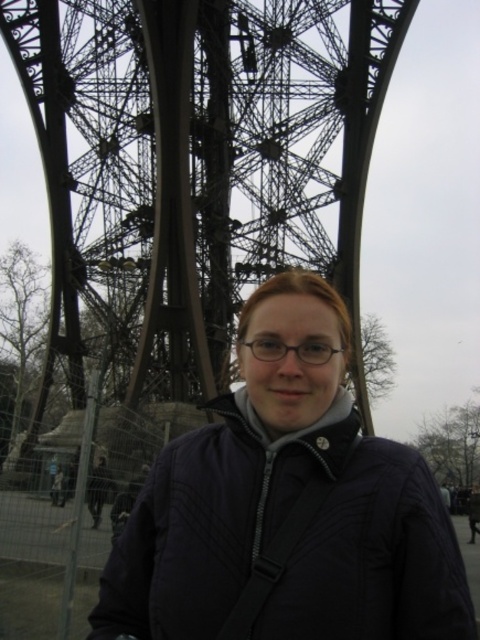
Question: Which object appears farthest from the camera in this image?

Choices:
 (A) matte black jacket at center
 (B) metallic structure at center

Answer: (B)

Question: Which of the following is the farthest from the observer?

Choices:
 (A) metallic structure at center
 (B) matte black jacket at center

Answer: (A)

Question: Considering the relative positions of metallic structure at center and matte black jacket at center in the image provided, where is metallic structure at center located with respect to matte black jacket at center?

Choices:
 (A) below
 (B) above

Answer: (B)

Question: Can you confirm if metallic structure at center is thinner than matte black jacket at center?

Choices:
 (A) no
 (B) yes

Answer: (A)

Question: Is metallic structure at center positioned in front of matte black jacket at center?

Choices:
 (A) yes
 (B) no

Answer: (B)